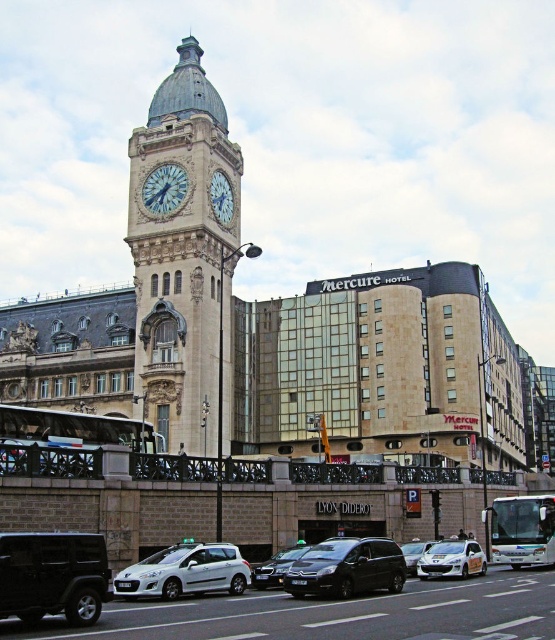
You are a city planner reviewing the urban layout. The point at coordinates [181,257] is marked on the map. Which structure does this point belong to?

The point at coordinates [181,257] is on the polished bronze clock tower at center left.

You are standing in the middle of the urban scene looking towards the historic clock tower. There are two points marked on the ground in front of you. The first point is at coordinates point (x=163, y=209) and the second is at point (x=218, y=218). Which point is closer to you?

Point (x=163, y=209) is in front of point (x=218, y=218), so the first point is closer to you.